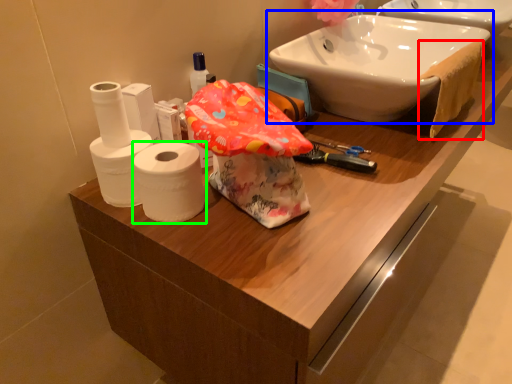
Question: Considering the real-world distances, which object is closest to bath towel (highlighted by a red box)? sink (highlighted by a blue box) or toilet paper (highlighted by a green box).

Choices:
 (A) sink
 (B) toilet paper

Answer: (A)